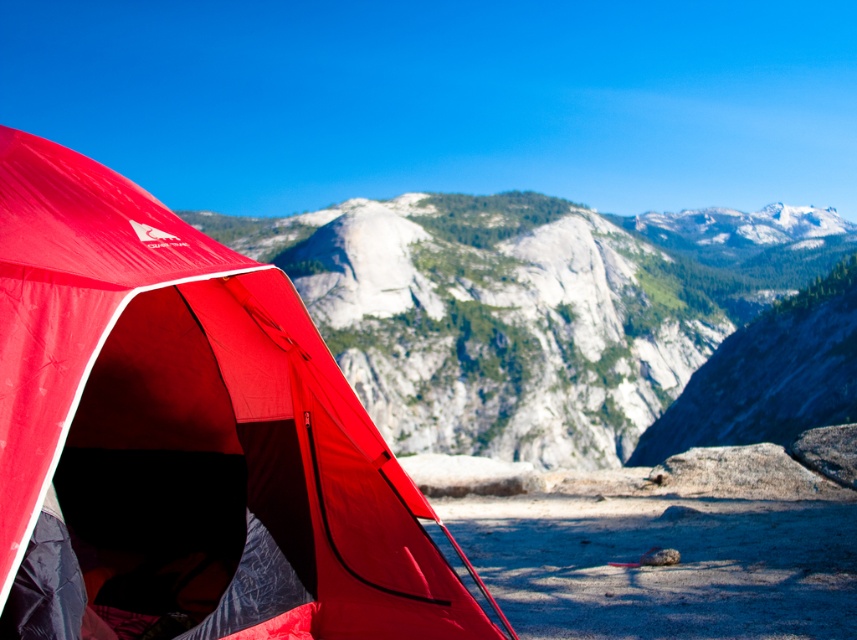
Question: Which object is closer to the camera taking this photo?

Choices:
 (A) matte gray rock at center
 (B) matte red tent at left

Answer: (B)

Question: Does matte red tent at left appear on the right side of matte gray rock at center?

Choices:
 (A) no
 (B) yes

Answer: (A)

Question: Considering the relative positions of matte red tent at left and matte gray rock at center in the image provided, where is matte red tent at left located with respect to matte gray rock at center?

Choices:
 (A) below
 (B) above

Answer: (A)

Question: Which point is farther to the camera?

Choices:
 (A) matte gray rock at center
 (B) matte red tent at left

Answer: (A)

Question: Is matte red tent at left closer to camera compared to matte gray rock at center?

Choices:
 (A) yes
 (B) no

Answer: (A)